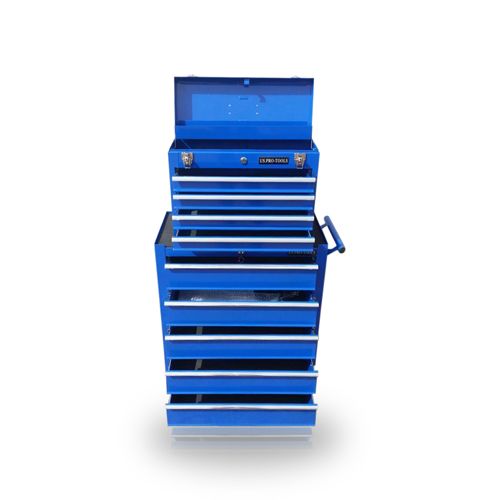
The height and width of the screenshot is (500, 500). Find the location of `boxes that look empty`. boxes that look empty is located at coordinates point(218,397), point(233,365), point(238,330), point(259,257), point(253,232), point(253,212), point(237,143), point(238,172).